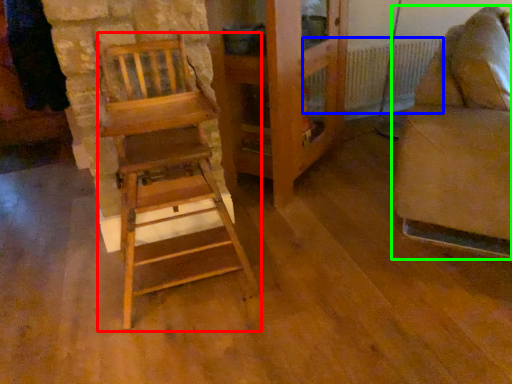
Question: Estimate the real-world distances between objects in this image. Which object is closer to furniture (highlighted by a red box), radiator (highlighted by a blue box) or furniture (highlighted by a green box)?

Choices:
 (A) radiator
 (B) furniture

Answer: (B)